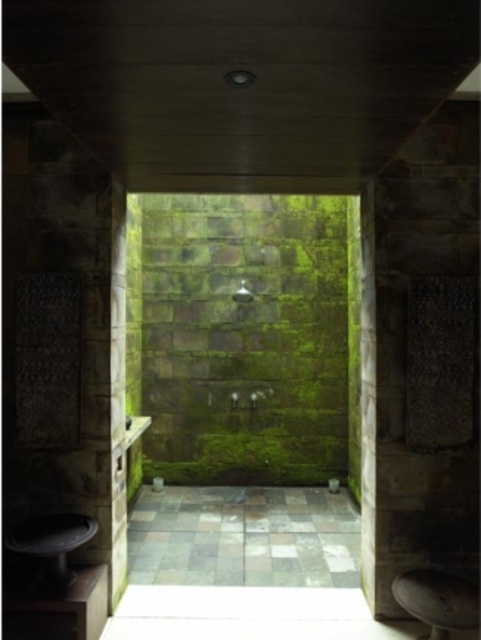
Is wooden stool at lower right bigger than matte green stone shower at center?

Yes, wooden stool at lower right is bigger than matte green stone shower at center.

Does point (431, 611) come behind point (248, 300)?

No.

Locate an element on the screen. The image size is (481, 640). wooden stool at lower right is located at coordinates (438, 600).